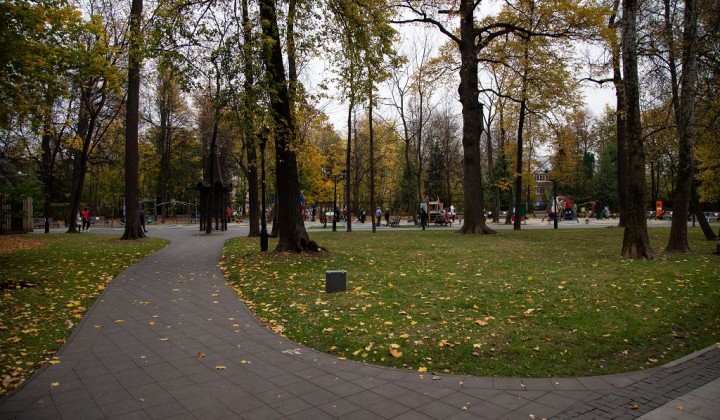
You are a GUI agent. You are given a task and a screenshot of the screen. Output one action in this format:
    pyautogui.click(x=<x>, y=<y>)
    Task: Click on the benches
    
    Given the screenshot: What is the action you would take?
    pyautogui.click(x=715, y=216), pyautogui.click(x=670, y=216), pyautogui.click(x=651, y=213)